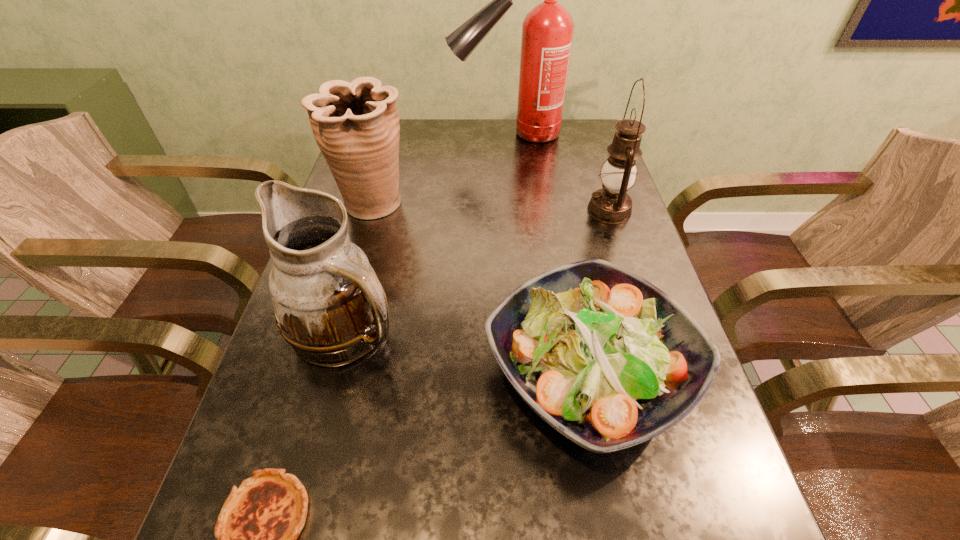
Find the location of a particular element. The width and height of the screenshot is (960, 540). fire extinguisher is located at coordinates (547, 31).

Identify the location of the tallest object. The image size is (960, 540). (547, 31).

Locate an element on the screen. oil lamp is located at coordinates (611, 204).

This screenshot has height=540, width=960. I want to click on pitcher, so click(x=329, y=305).

In order to click on urn in this screenshot , I will do `click(356, 125)`.

I want to click on the second shortest object, so click(x=606, y=358).

Identify the location of vacant space located 0.290m at the nozzle end of the tallest object. The width and height of the screenshot is (960, 540). (362, 134).

Where is `free space located at the nozzle end of the tallest object`? The width and height of the screenshot is (960, 540). free space located at the nozzle end of the tallest object is located at coordinates (x=395, y=134).

This screenshot has height=540, width=960. In order to click on free spot located 0.130m at the nozzle end of the tallest object in this screenshot , I will do pyautogui.click(x=410, y=134).

Where is `vacant point located 0.200m on the back of the oil lamp`? Image resolution: width=960 pixels, height=540 pixels. vacant point located 0.200m on the back of the oil lamp is located at coordinates (591, 156).